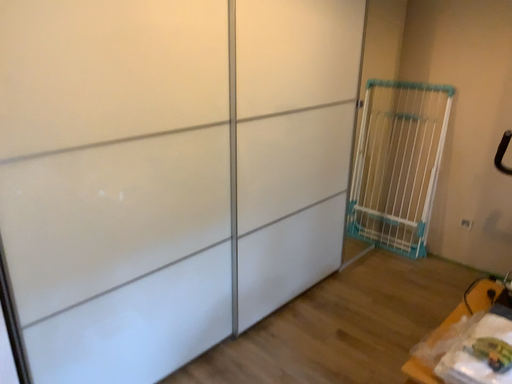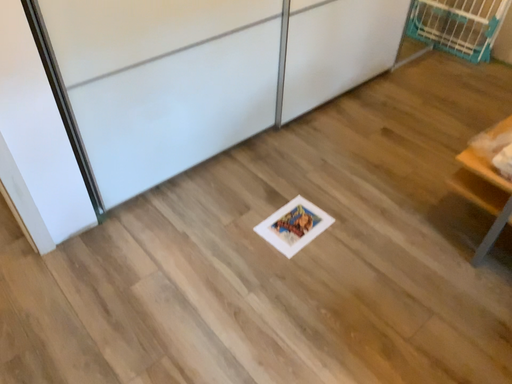
Question: Which way did the camera rotate in the video?

Choices:
 (A) rotated downward
 (B) rotated upward

Answer: (A)